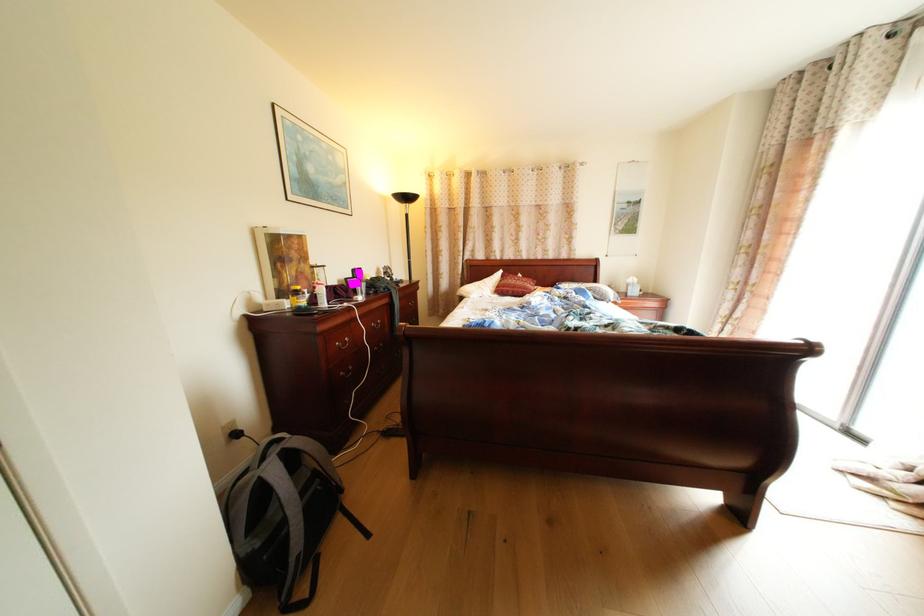
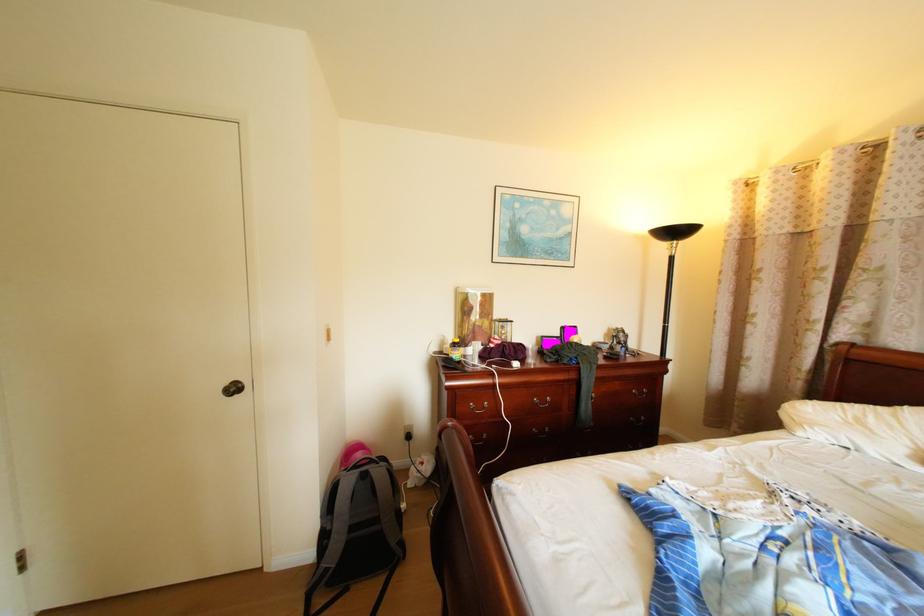
Locate, in the second image, the point that corresponds to point (333, 284) in the first image.

(509, 339)